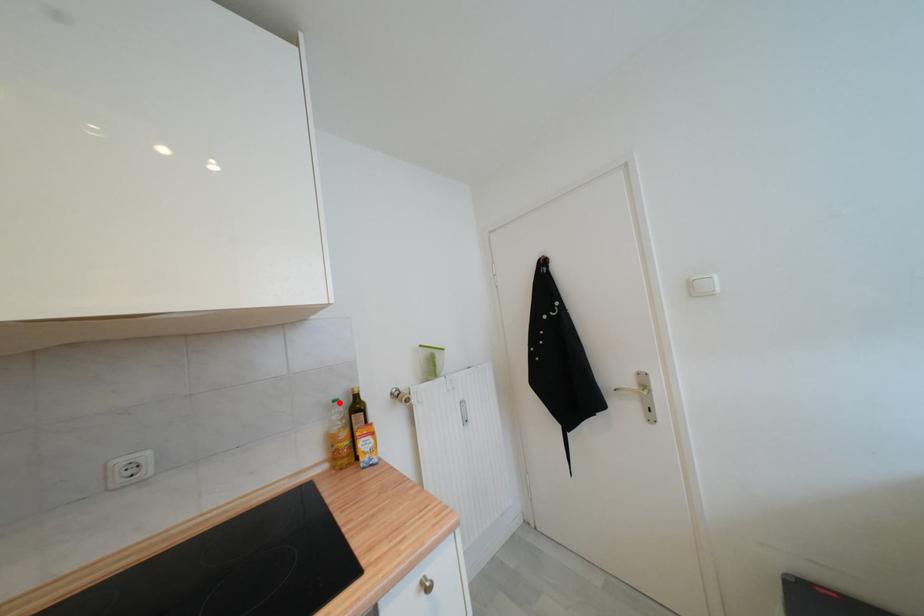
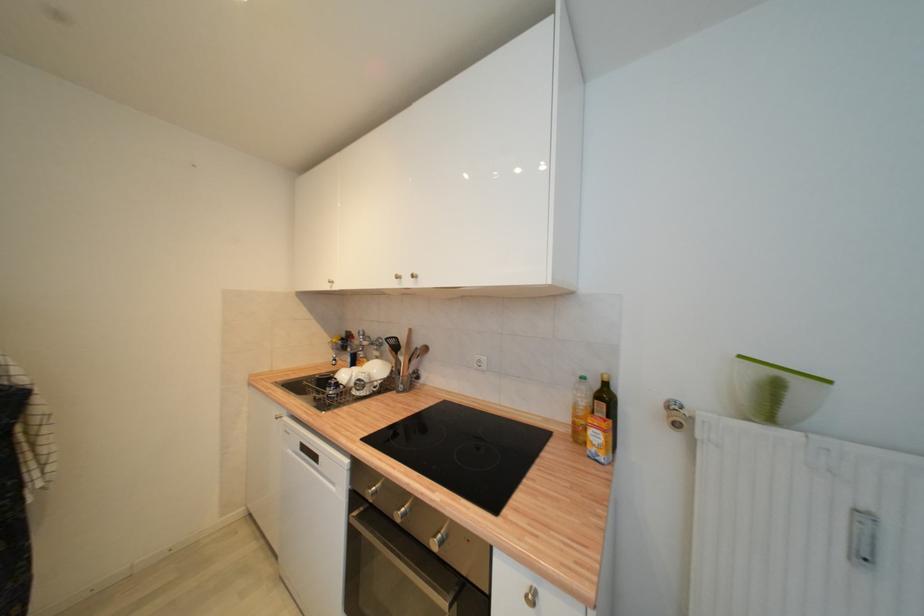
The point at the highlighted location is marked in the first image. Where is the corresponding point in the second image?

(586, 379)